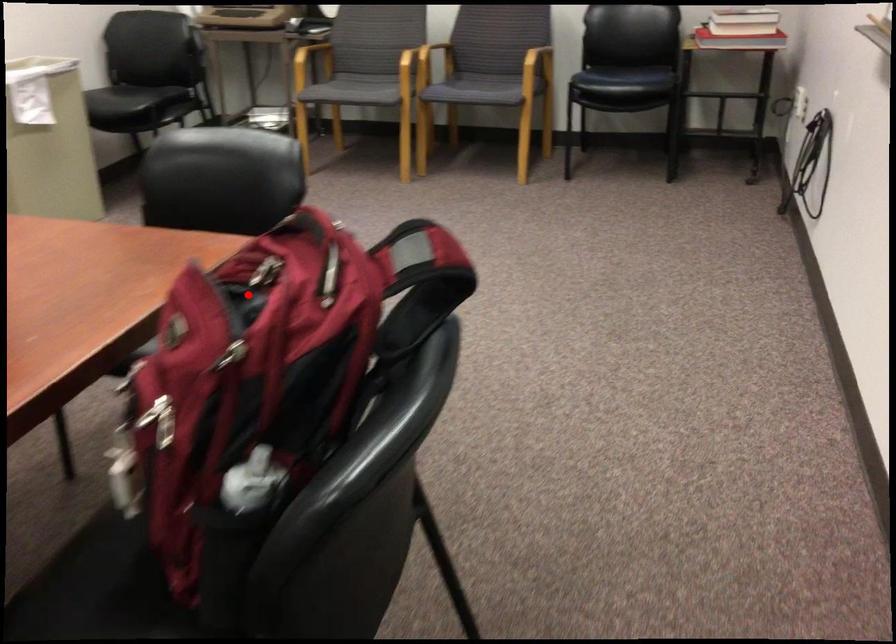
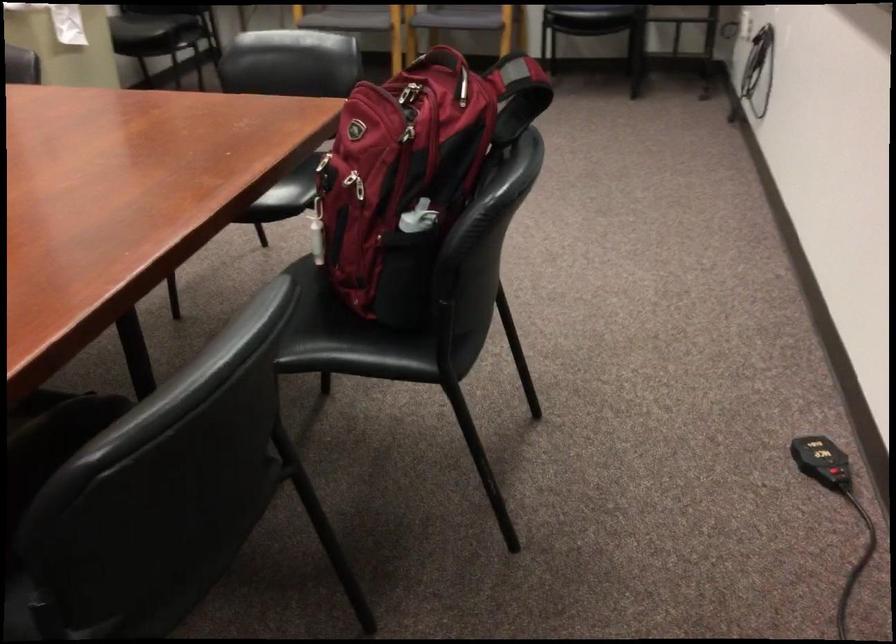
Question: A red point is marked in image1. In image2, is the corresponding 3D point closer to the camera or farther? Reply with the corresponding letter.

Choices:
 (A) The corresponding 3D point is closer.
 (B) The corresponding 3D point is farther.

Answer: (B)